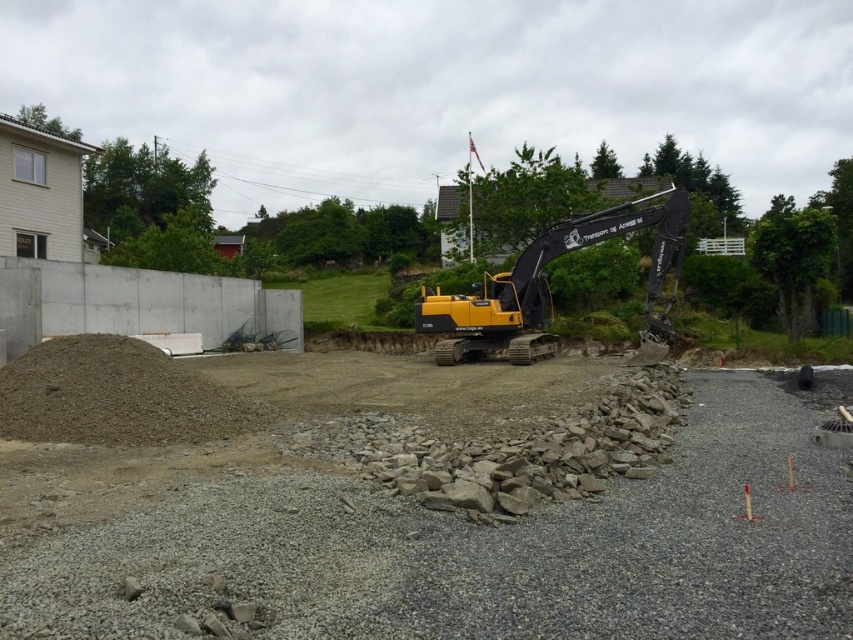
Question: Does gray gravel at center appear under yellow/black excavator at center?

Choices:
 (A) no
 (B) yes

Answer: (B)

Question: Which object appears closest to the camera in this image?

Choices:
 (A) gray gravel at center
 (B) gray gravel pile at lower left

Answer: (A)

Question: Among these points, which one is farthest from the camera?

Choices:
 (A) (x=508, y=392)
 (B) (x=495, y=301)
 (C) (x=187, y=369)

Answer: (B)

Question: Which of the following is the closest to the observer?

Choices:
 (A) (241, 417)
 (B) (480, 637)
 (C) (579, 232)

Answer: (B)

Question: Is gray gravel at center to the left of yellow/black excavator at center from the viewer's perspective?

Choices:
 (A) no
 (B) yes

Answer: (B)

Question: Where is gray gravel pile at lower left located in relation to yellow/black excavator at center in the image?

Choices:
 (A) right
 (B) left

Answer: (B)